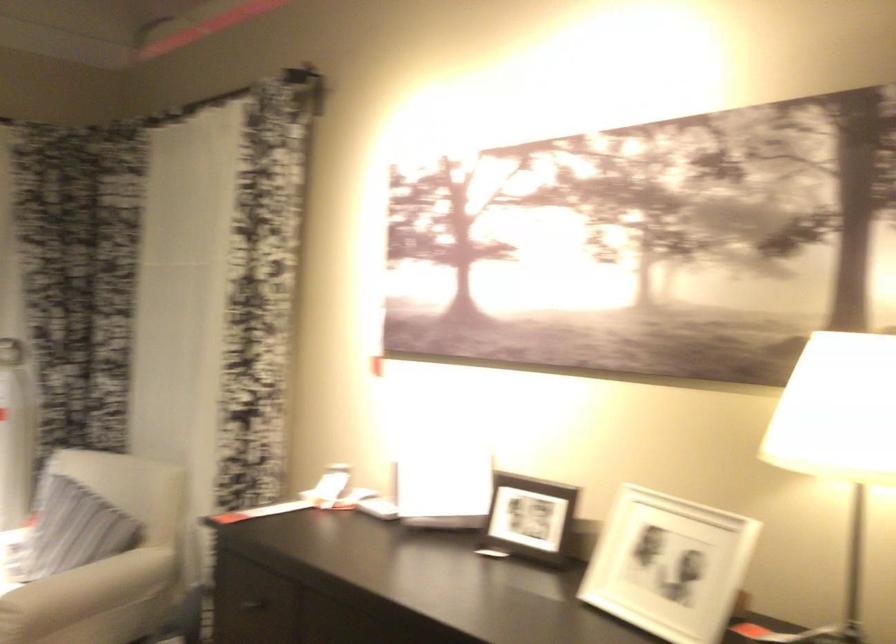
Where would you pull the dark drawer handle? Please return your answer as a coordinate pair (x, y).

(239, 605)